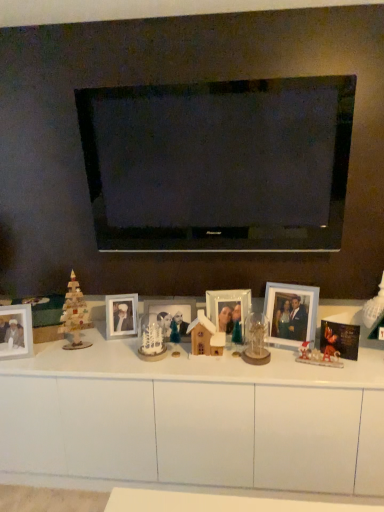
This screenshot has height=512, width=384. Find the location of `free space in front of metallic silver photo frame at center, positioned as the 2th picture frame in right-to-left order`. free space in front of metallic silver photo frame at center, positioned as the 2th picture frame in right-to-left order is located at coordinates (229, 369).